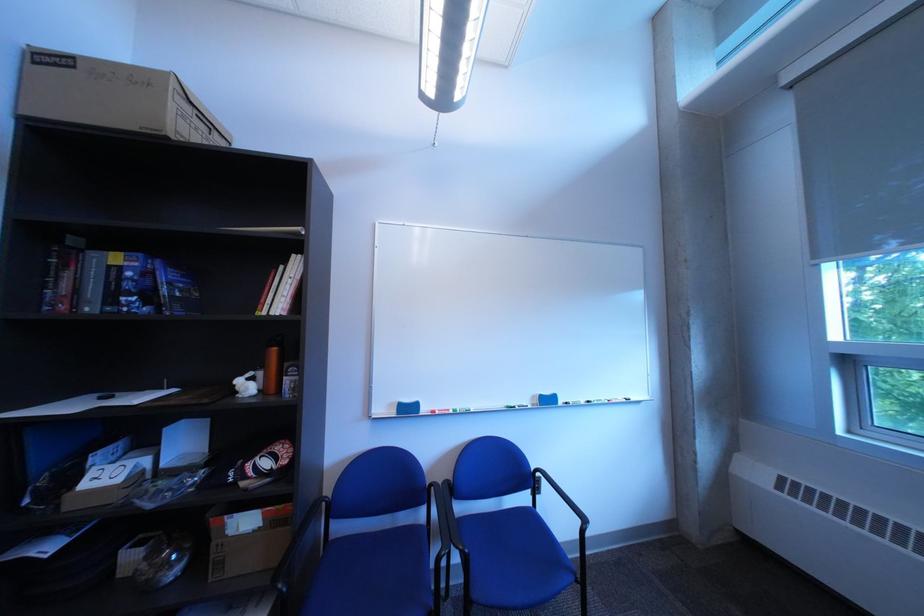
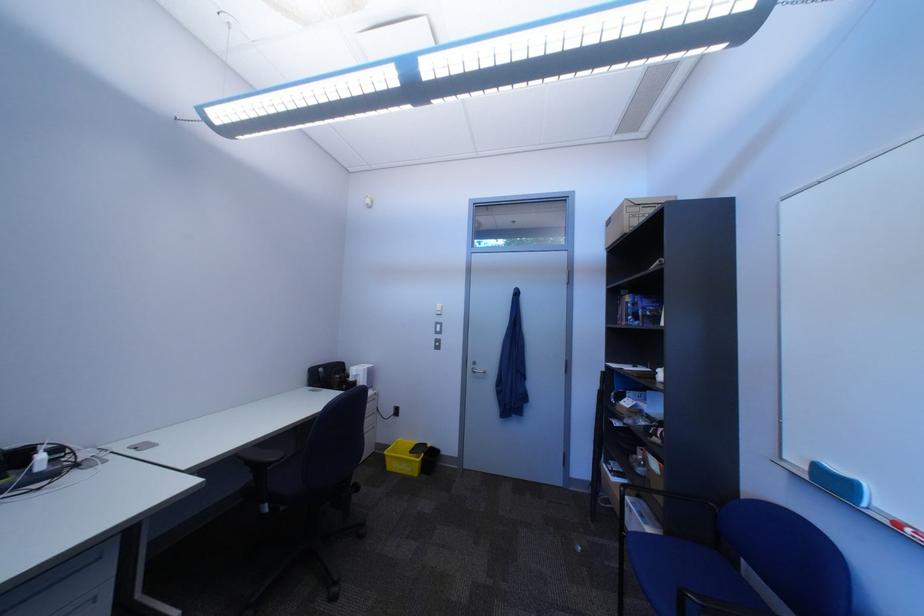
In the second image, find the point that corresponds to point 450,414 in the first image.

(915, 527)